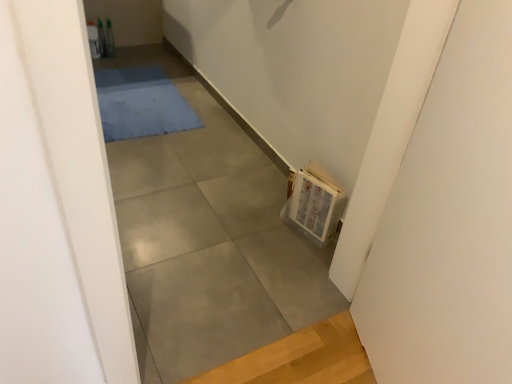
Image resolution: width=512 pixels, height=384 pixels. Describe the element at coordinates (315, 203) in the screenshot. I see `wooden frame at right` at that location.

Where is `gray concrete at center`? The image size is (512, 384). gray concrete at center is located at coordinates (208, 239).

Is blue soft rug at upper center at the back of wooden frame at right?

wooden frame at right is not turned away from blue soft rug at upper center.

Find the location of a particular element. The width and height of the screenshot is (512, 384). mat that is behind the wooden frame at right is located at coordinates (141, 103).

From a real-world perspective, is wooden frame at right beneath blue soft rug at upper center?

No, from a real-world perspective, wooden frame at right is not beneath blue soft rug at upper center.

Based on the photo, from the image's perspective, which is below, wooden frame at right or gray concrete at center?

wooden frame at right.

Considering the positions of objects wooden frame at right and gray concrete at center in the image provided, who is behind, wooden frame at right or gray concrete at center?

wooden frame at right is behind.

Is wooden frame at right facing away from gray concrete at center?

No, wooden frame at right is not facing the opposite direction of gray concrete at center.

Is wooden frame at right with gray concrete at center?

wooden frame at right and gray concrete at center are not in contact.

Would you say gray concrete at center is outside blue soft rug at upper center?

Yes.

Considering the relative sizes of gray concrete at center and blue soft rug at upper center in the image provided, is gray concrete at center wider than blue soft rug at upper center?

Yes, gray concrete at center is wider than blue soft rug at upper center.

Does gray concrete at center turn towards blue soft rug at upper center?

No, gray concrete at center is not facing towards blue soft rug at upper center.

Is gray concrete at center wider or thinner than wooden frame at right?

In the image, gray concrete at center appears to be wider than wooden frame at right.

Is wooden frame at right at the back of gray concrete at center?

No, gray concrete at center's orientation is not away from wooden frame at right.

Is wooden frame at right completely or partially inside gray concrete at center?

No, gray concrete at center does not contain wooden frame at right.

From the image's perspective, which object appears higher, blue soft rug at upper center or wooden frame at right?

From the image's view, blue soft rug at upper center is above.

Does blue soft rug at upper center have a larger size compared to wooden frame at right?

Indeed, blue soft rug at upper center has a larger size compared to wooden frame at right.

Looking at the image, does blue soft rug at upper center seem bigger or smaller compared to gray concrete at center?

Clearly, blue soft rug at upper center is smaller in size than gray concrete at center.

Can you tell me how much blue soft rug at upper center and gray concrete at center differ in facing direction?

The angular difference between blue soft rug at upper center and gray concrete at center is 1.72 degrees.

You are a GUI agent. You are given a task and a screenshot of the screen. Output one action in this format:
    pyautogui.click(x=<x>, y=<y>)
    Task: Click on the mat on the left side of gray concrete at center
    
    Given the screenshot: What is the action you would take?
    pyautogui.click(x=141, y=103)

Looking at this image, which object is positioned more to the left, blue soft rug at upper center or gray concrete at center?

blue soft rug at upper center is more to the left.

Locate an element on the screen. book located on the right of blue soft rug at upper center is located at coordinates click(x=315, y=203).

You are a GUI agent. You are given a task and a screenshot of the screen. Output one action in this format:
    pyautogui.click(x=<x>, y=<y>)
    Task: Click on the concrete below the wooden frame at right (from a real-world perspective)
    This screenshot has height=384, width=512.
    Given the screenshot: What is the action you would take?
    pyautogui.click(x=208, y=239)

From the image, which object appears to be nearer to wooden frame at right, gray concrete at center or blue soft rug at upper center?

gray concrete at center is closer to wooden frame at right.

In the scene shown: When comparing their distances from blue soft rug at upper center, does wooden frame at right or gray concrete at center seem closer?

Among the two, gray concrete at center is located nearer to blue soft rug at upper center.

Considering their positions, is blue soft rug at upper center positioned further to gray concrete at center than wooden frame at right?

Among the two, blue soft rug at upper center is located further to gray concrete at center.

Looking at the image, which one is located closer to wooden frame at right, blue soft rug at upper center or gray concrete at center?

gray concrete at center is closer to wooden frame at right.

When comparing their distances from gray concrete at center, does wooden frame at right or blue soft rug at upper center seem further?

Based on the image, blue soft rug at upper center appears to be further to gray concrete at center.

Estimate the real-world distances between objects in this image. Which object is closer to blue soft rug at upper center, gray concrete at center or wooden frame at right?

gray concrete at center is positioned closer to the anchor blue soft rug at upper center.

I want to click on book between gray concrete at center and blue soft rug at upper center from front to back, so click(315, 203).